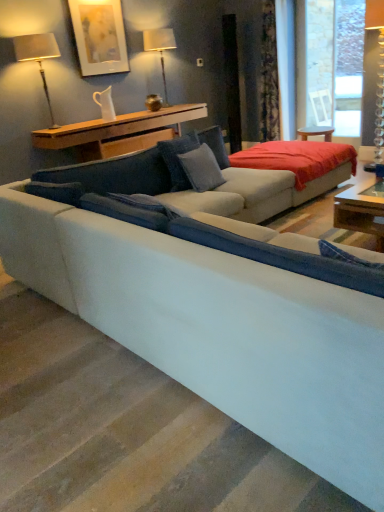
Question: Is matte silver table lamp at upper left, which ranks as the 1th table lamp in front-to-back order, not within matte white picture frame at upper left?

Choices:
 (A) no
 (B) yes

Answer: (B)

Question: Is matte silver table lamp at upper left, which ranks as the 1th table lamp in front-to-back order, behind matte white picture frame at upper left?

Choices:
 (A) yes
 (B) no

Answer: (B)

Question: Does matte silver table lamp at upper left, which ranks as the 1th table lamp in left-to-right order, have a lesser height compared to matte white picture frame at upper left?

Choices:
 (A) no
 (B) yes

Answer: (A)

Question: Are matte silver table lamp at upper left, which ranks as the 1th table lamp in front-to-back order, and matte white picture frame at upper left far apart?

Choices:
 (A) no
 (B) yes

Answer: (A)

Question: From a real-world perspective, is matte silver table lamp at upper left, which ranks as the 1th table lamp in left-to-right order, beneath matte white picture frame at upper left?

Choices:
 (A) no
 (B) yes

Answer: (B)

Question: Does matte silver table lamp at upper left, the second table lamp when ordered from back to front, lie in front of matte white picture frame at upper left?

Choices:
 (A) yes
 (B) no

Answer: (A)

Question: Can you confirm if matte white picture frame at upper left is wider than suede-like blue pillow at center, the first pillow from the left?

Choices:
 (A) yes
 (B) no

Answer: (B)

Question: Is matte white picture frame at upper left closer to camera compared to suede-like blue pillow at center, the first pillow from the left?

Choices:
 (A) yes
 (B) no

Answer: (B)

Question: Would you say suede-like blue pillow at center, which is the second pillow in right-to-left order, is part of matte white picture frame at upper left's contents?

Choices:
 (A) yes
 (B) no

Answer: (B)

Question: Does matte white picture frame at upper left have a lesser width compared to suede-like blue pillow at center, the first pillow from the left?

Choices:
 (A) yes
 (B) no

Answer: (A)

Question: Does matte white picture frame at upper left lie behind suede-like blue pillow at center, which is the second pillow in right-to-left order?

Choices:
 (A) no
 (B) yes

Answer: (B)

Question: Is matte white picture frame at upper left looking in the opposite direction of suede-like blue pillow at center, the first pillow from the left?

Choices:
 (A) no
 (B) yes

Answer: (A)

Question: Does suede-like blue pillow at center, the first pillow from the left, have a greater width compared to matte silver table lamp at upper left, the second table lamp when ordered from back to front?

Choices:
 (A) no
 (B) yes

Answer: (B)